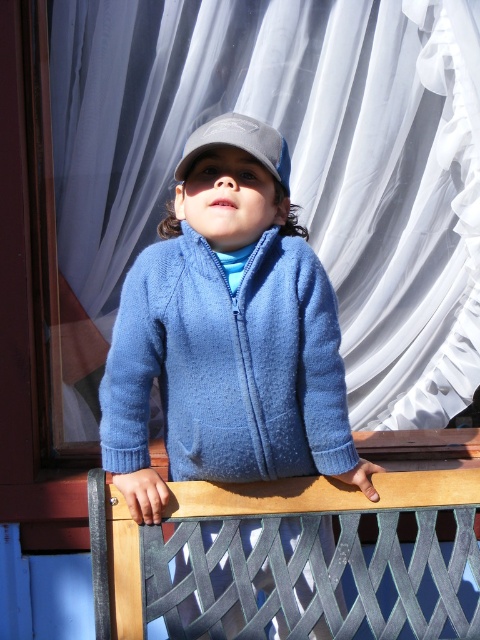
Question: Where is white sheer curtain at upper center located in relation to gray fabric cap at center in the image?

Choices:
 (A) above
 (B) below

Answer: (B)

Question: Where is white sheer curtain at upper center located in relation to blue fuzzy jacket at center in the image?

Choices:
 (A) left
 (B) right

Answer: (B)

Question: Which of the following is the closest to the observer?

Choices:
 (A) blue fleece jacket at center
 (B) gray fabric cap at center
 (C) white sheer curtain at upper center
 (D) blue fuzzy jacket at center

Answer: (B)

Question: Which point is closer to the camera?

Choices:
 (A) blue fuzzy jacket at center
 (B) blue fleece jacket at center
 (C) white sheer curtain at upper center
 (D) gray fabric cap at center

Answer: (D)

Question: Is blue fleece jacket at center above blue fuzzy jacket at center?

Choices:
 (A) yes
 (B) no

Answer: (B)

Question: Which point is closer to the camera taking this photo?

Choices:
 (A) (458, 252)
 (B) (182, 369)
 (C) (271, 330)
 (D) (252, 154)

Answer: (D)